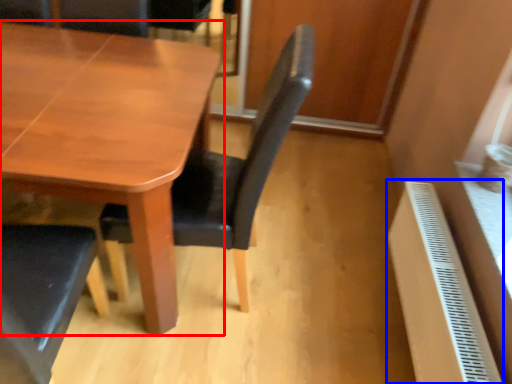
Question: Which of the following is the closest to the observer, table (highlighted by a red box) or radiator (highlighted by a blue box)?

Choices:
 (A) table
 (B) radiator

Answer: (A)